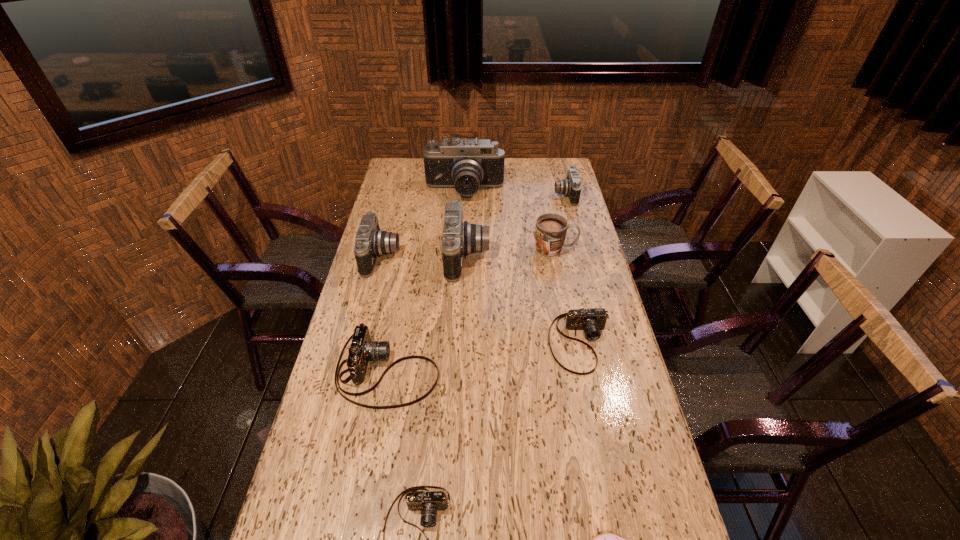
You are a GUI agent. You are given a task and a screenshot of the screen. Output one action in this format:
    pyautogui.click(x=<x>, y=<y>)
    Task: Click on the object identified as the closest to the rightmost brown camera
    
    Given the screenshot: What is the action you would take?
    pyautogui.click(x=459, y=237)

The height and width of the screenshot is (540, 960). I want to click on object that stands as the fifth closest to the sixth tallest object, so click(608, 539).

Identify the location of camera object that ranks as the fourth closest to the second biggest brown camera. The width and height of the screenshot is (960, 540). (370, 242).

Locate an element on the screen. This screenshot has width=960, height=540. the sixth closest camera to the biggest brown camera is located at coordinates (571, 187).

Select which black camera appears as the second closest to the rightmost brown camera. Please provide its 2D coordinates. Your answer should be formatted as a tuple, i.e. [(x, y)], where the tuple contains the x and y coordinates of a point satisfying the conditions above.

[(370, 242)]

Where is `black camera that stands as the closest to the shortest camera`? black camera that stands as the closest to the shortest camera is located at coordinates (459, 237).

Identify which brown camera is the closest to the shortest camera. Please provide its 2D coordinates. Your answer should be formatted as a tuple, i.e. [(x, y)], where the tuple contains the x and y coordinates of a point satisfying the conditions above.

[(362, 350)]

Select which brown camera is the closest to the biggest brown camera. Please provide its 2D coordinates. Your answer should be formatted as a tuple, i.e. [(x, y)], where the tuple contains the x and y coordinates of a point satisfying the conditions above.

[(428, 503)]